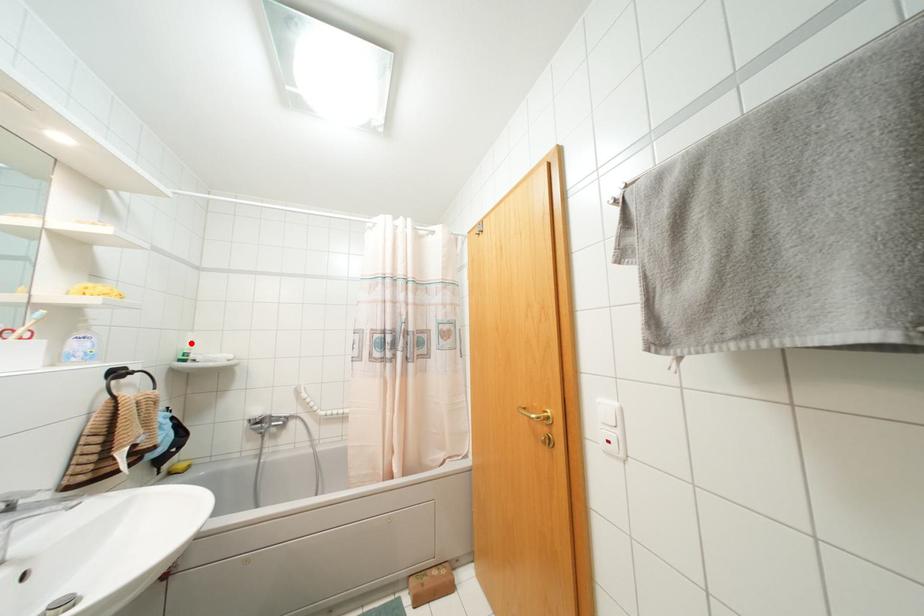
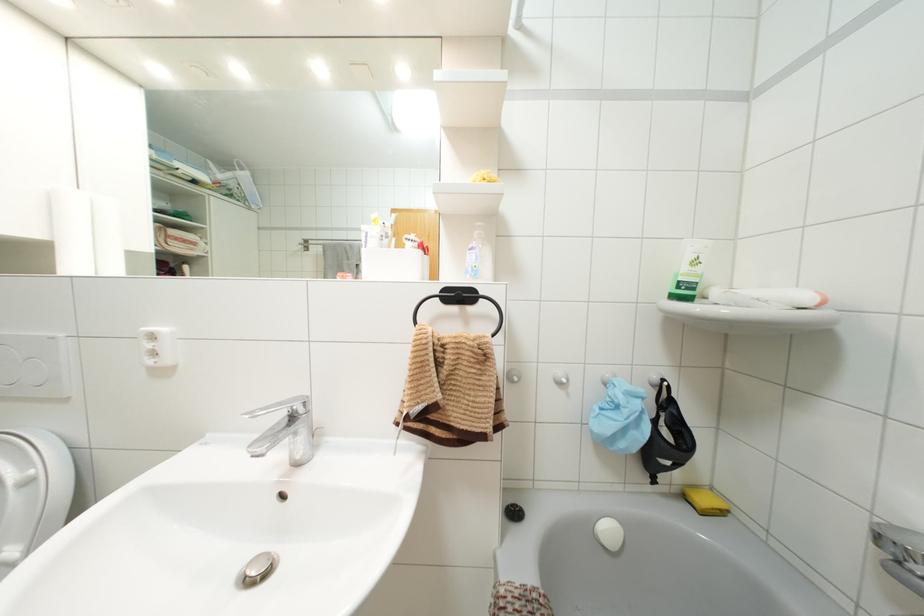
Locate, in the second image, the point that corresponds to the highlighted location in the first image.

(695, 262)